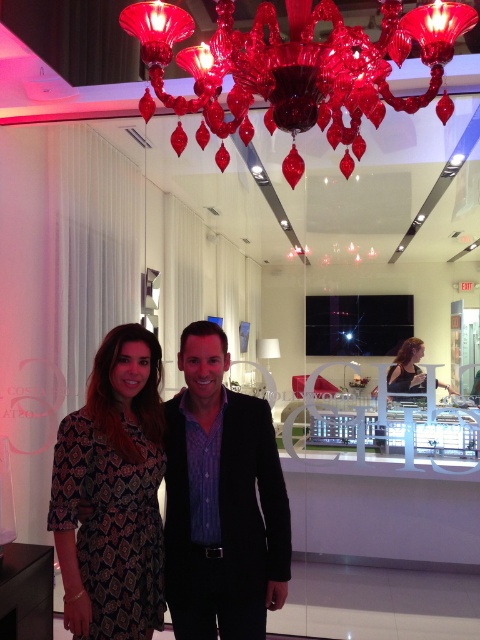
From the picture: You are standing in the showroom and see two points marked in the image. The first point is at coordinate point [312,88] and the second is at point [132,333]. Which point is closer to you?

Point [312,88] is in front of point [132,333], so it is closer to you.

You are a photographer setting up for a photoshoot in the described scene. You need to ensure that both the matte black suit at center and the matte black dress at center are visible in the frame. Based on their positions, which one should you focus on first to capture both in the shot?

The matte black suit at center is located below the matte black dress at center, so focusing on the dress first will ensure both are in the frame since the dress is higher up and the suit is positioned beneath it.